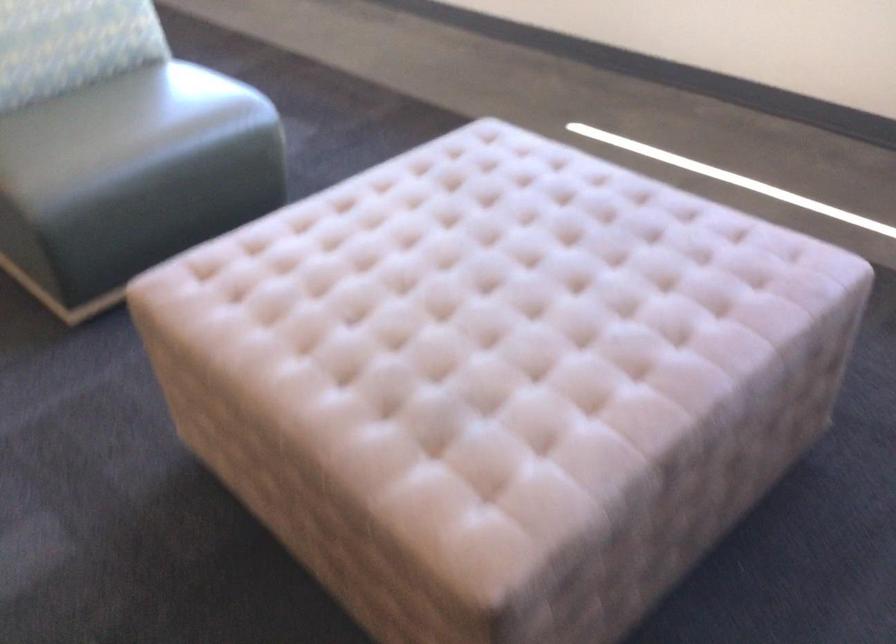
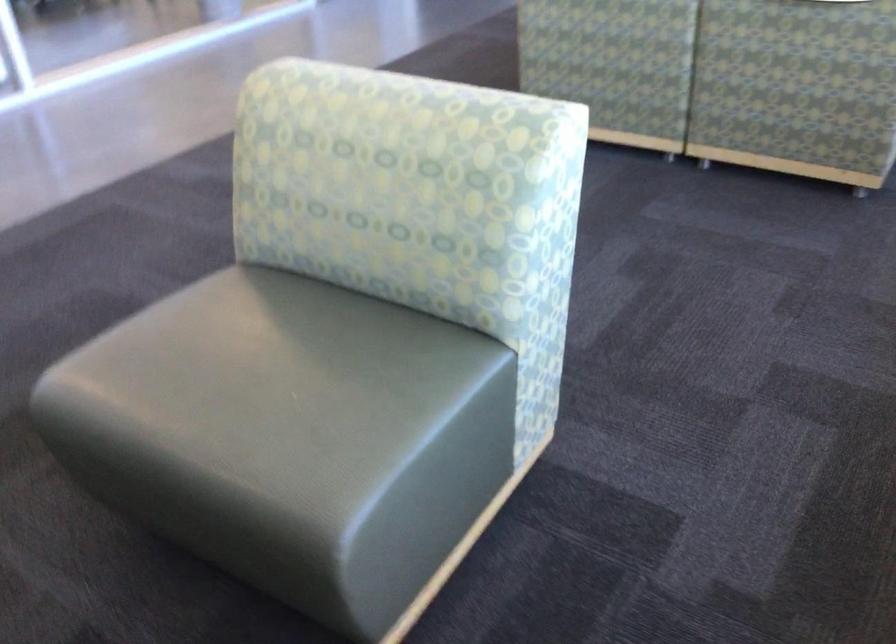
Find the pixel in the second image that matches the point at 153,111 in the first image.

(279, 389)